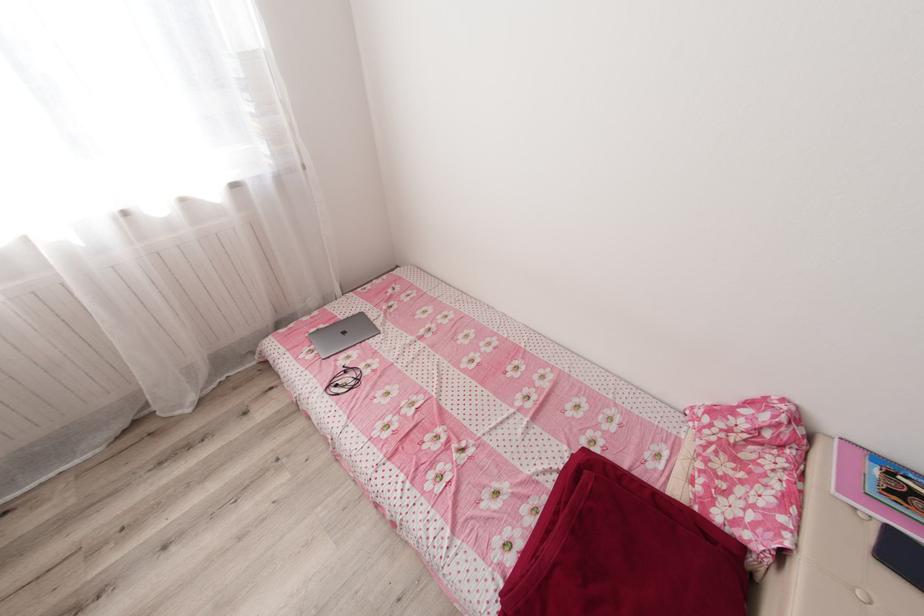
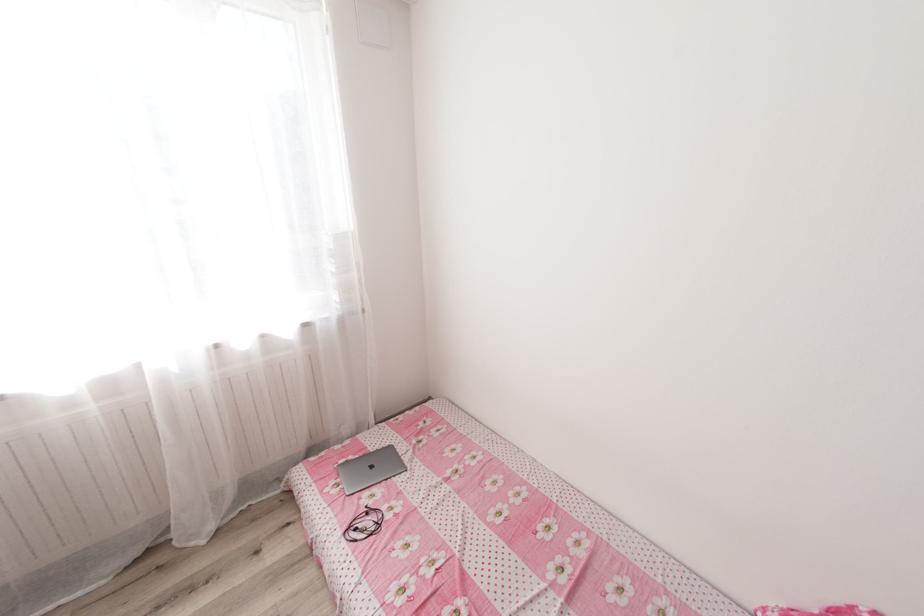
Question: The images are taken continuously from a first-person perspective. In which direction are you moving?

Choices:
 (A) Left
 (B) Right
 (C) Forward
 (D) Backward

Answer: (D)